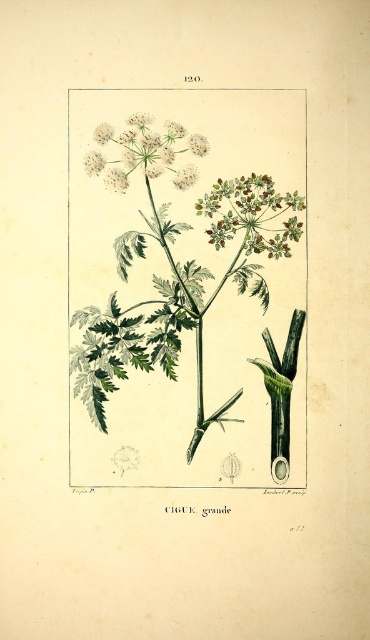
Is point (241, 225) less distant than point (95, 161)?

No, (241, 225) is behind (95, 161).

Does green textured flower at upper center appear under white fluffy flower at upper center?

Indeed, green textured flower at upper center is positioned under white fluffy flower at upper center.

Which is in front, point (268, 221) or point (86, 163)?

Positioned in front is point (86, 163).

I want to click on green textured flower at upper center, so click(251, 214).

Between green leafy plant at center and white fluffy flower at upper center, which one is positioned lower?

green leafy plant at center

From the picture: Which of these two, green leafy plant at center or white fluffy flower at upper center, stands taller?

With more height is green leafy plant at center.

Locate an element on the screen. This screenshot has width=370, height=640. green leafy plant at center is located at coordinates (186, 288).

Between green leafy plant at center and green textured flower at upper center, which one is positioned lower?

green leafy plant at center

Is point (304, 244) closer to camera compared to point (237, 218)?

Yes.

Does point (259, 353) lie in front of point (286, 252)?

Yes, it is in front of point (286, 252).

Find the location of a particular element. The width and height of the screenshot is (370, 640). green leafy plant at center is located at coordinates (186, 288).